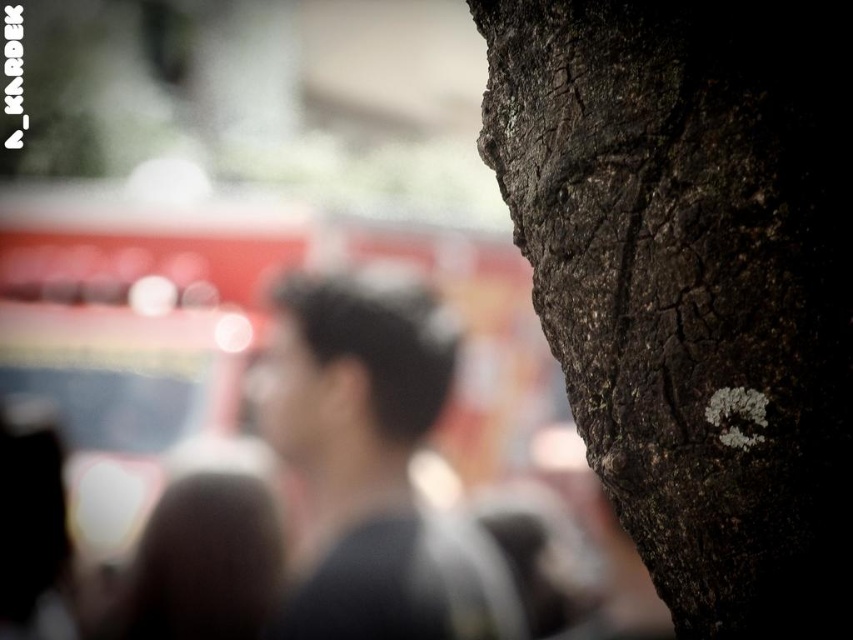
Can you confirm if dark brown rough bark at center is taller than dark gray hair at center?

No.

The width and height of the screenshot is (853, 640). What are the coordinates of `dark brown rough bark at center` in the screenshot? It's located at (695, 282).

Find the location of a particular element. dark brown rough bark at center is located at coordinates (695, 282).

Identify the location of dark brown rough bark at center. The height and width of the screenshot is (640, 853). (695, 282).